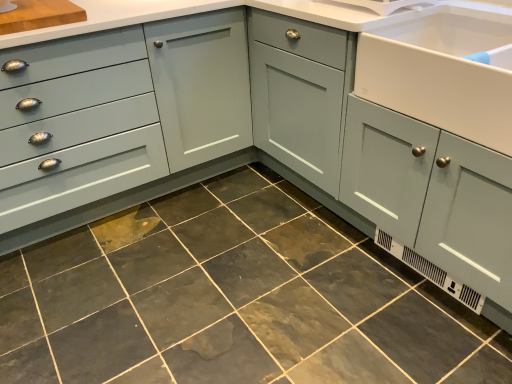
Question: Does dark gray stone tile at center lie behind white glossy sink at right?

Choices:
 (A) no
 (B) yes

Answer: (A)

Question: From the image's perspective, would you say dark gray stone tile at center is shown under white glossy sink at right?

Choices:
 (A) no
 (B) yes

Answer: (B)

Question: Is dark gray stone tile at center not near white glossy sink at right?

Choices:
 (A) yes
 (B) no

Answer: (B)

Question: Is dark gray stone tile at center oriented towards white glossy sink at right?

Choices:
 (A) yes
 (B) no

Answer: (B)

Question: Is dark gray stone tile at center to the left of white glossy sink at right from the viewer's perspective?

Choices:
 (A) no
 (B) yes

Answer: (B)

Question: Is dark gray stone tile at center at the right side of white glossy sink at right?

Choices:
 (A) no
 (B) yes

Answer: (A)

Question: Is matte gray drawer at left a part of white glossy sink at right?

Choices:
 (A) yes
 (B) no

Answer: (B)

Question: Would you consider white glossy sink at right to be distant from matte gray drawer at left?

Choices:
 (A) no
 (B) yes

Answer: (B)

Question: Can you confirm if white glossy sink at right is positioned to the right of matte gray drawer at left?

Choices:
 (A) no
 (B) yes

Answer: (B)

Question: Considering the relative sizes of white glossy sink at right and matte gray drawer at left in the image provided, is white glossy sink at right taller than matte gray drawer at left?

Choices:
 (A) no
 (B) yes

Answer: (A)

Question: Could you tell me if white glossy sink at right is turned towards matte gray drawer at left?

Choices:
 (A) yes
 (B) no

Answer: (B)

Question: Considering the relative sizes of white glossy sink at right and matte gray drawer at left in the image provided, is white glossy sink at right shorter than matte gray drawer at left?

Choices:
 (A) no
 (B) yes

Answer: (B)

Question: Does matte gray drawer at left have a larger size compared to dark gray stone tile at center?

Choices:
 (A) no
 (B) yes

Answer: (B)